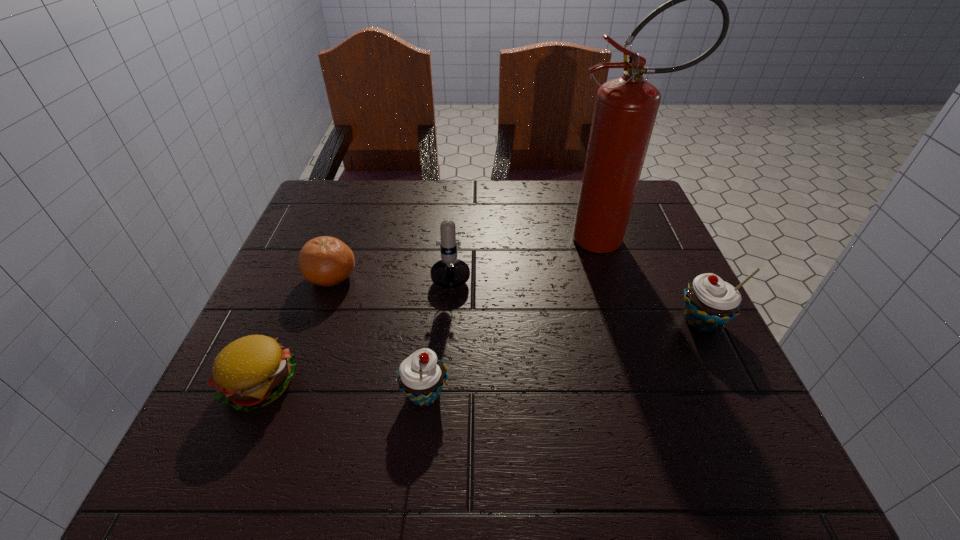
I want to click on the nearer cupcake, so (x=421, y=377).

In order to click on the left cupcake in this screenshot , I will do click(421, 377).

Locate an element on the screen. the right cupcake is located at coordinates (710, 302).

This screenshot has height=540, width=960. In order to click on the farther cupcake in this screenshot , I will do `click(710, 302)`.

You are a GUI agent. You are given a task and a screenshot of the screen. Output one action in this format:
    pyautogui.click(x=<x>, y=<y>)
    Task: Click on the clementine
    
    Given the screenshot: What is the action you would take?
    pyautogui.click(x=326, y=261)

The image size is (960, 540). In order to click on fire extinguisher in this screenshot , I will do `click(625, 110)`.

You are a GUI agent. You are given a task and a screenshot of the screen. Output one action in this format:
    pyautogui.click(x=<x>, y=<y>)
    Task: Click on the microphone
    
    Given the screenshot: What is the action you would take?
    pyautogui.click(x=450, y=272)

Where is `hamburger`? Image resolution: width=960 pixels, height=540 pixels. hamburger is located at coordinates (253, 371).

I want to click on free space located 0.400m on the right of the left cupcake, so click(681, 393).

Locate an element on the screen. vacant position located 0.160m on the back of the third nearest object is located at coordinates (668, 253).